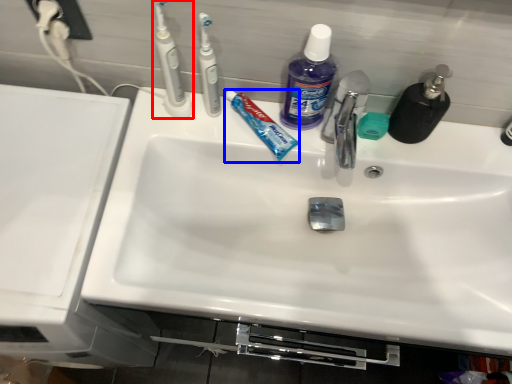
Question: Which object appears farthest to the camera in this image, toothbrush (highlighted by a red box) or toothpaste (highlighted by a blue box)?

Choices:
 (A) toothbrush
 (B) toothpaste

Answer: (B)